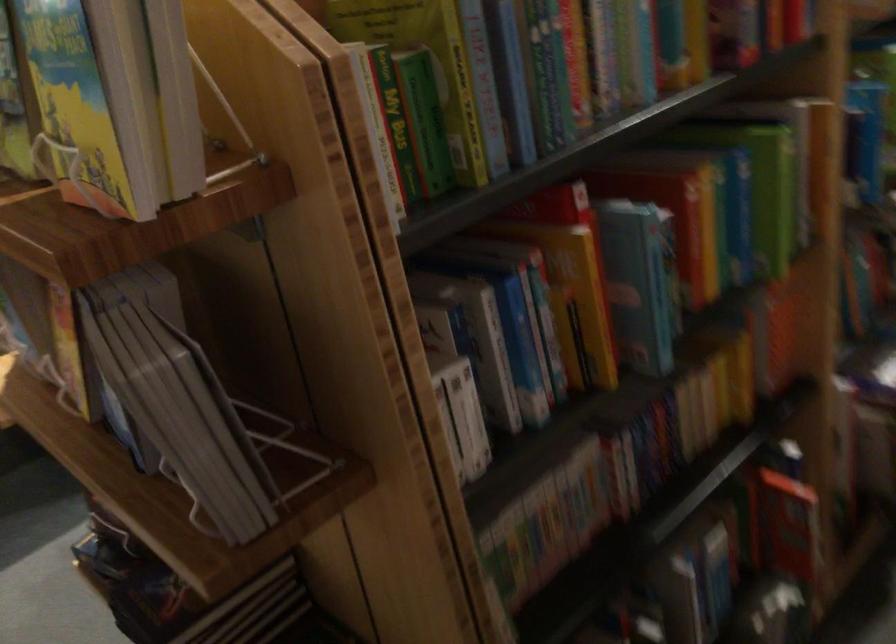
The height and width of the screenshot is (644, 896). Describe the element at coordinates (778, 202) in the screenshot. I see `the green spine book` at that location.